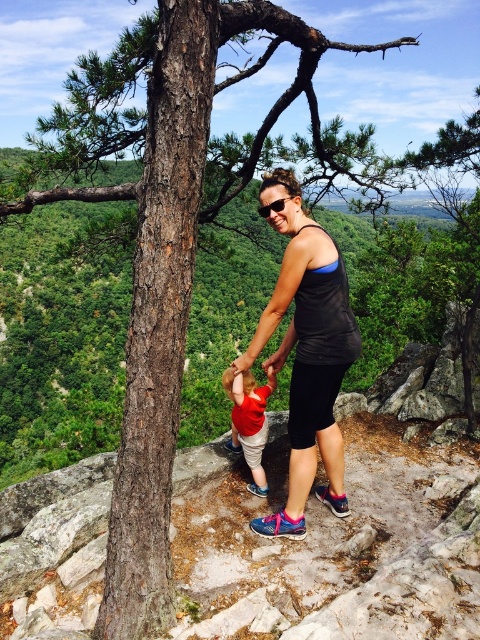
Question: Which of the following is the farthest from the observer?

Choices:
 (A) (254, 477)
 (B) (299, 288)

Answer: (A)

Question: Can you confirm if black matte tank top at center is positioned to the left of red cotton shirt at center?

Choices:
 (A) no
 (B) yes

Answer: (A)

Question: Which point appears closest to the camera in this image?

Choices:
 (A) (250, 456)
 (B) (317, 253)

Answer: (B)

Question: From the image, what is the correct spatial relationship of black matte tank top at center in relation to red cotton shirt at center?

Choices:
 (A) left
 (B) right

Answer: (B)

Question: Observing the image, what is the correct spatial positioning of black matte tank top at center in reference to red cotton shirt at center?

Choices:
 (A) below
 (B) above

Answer: (B)